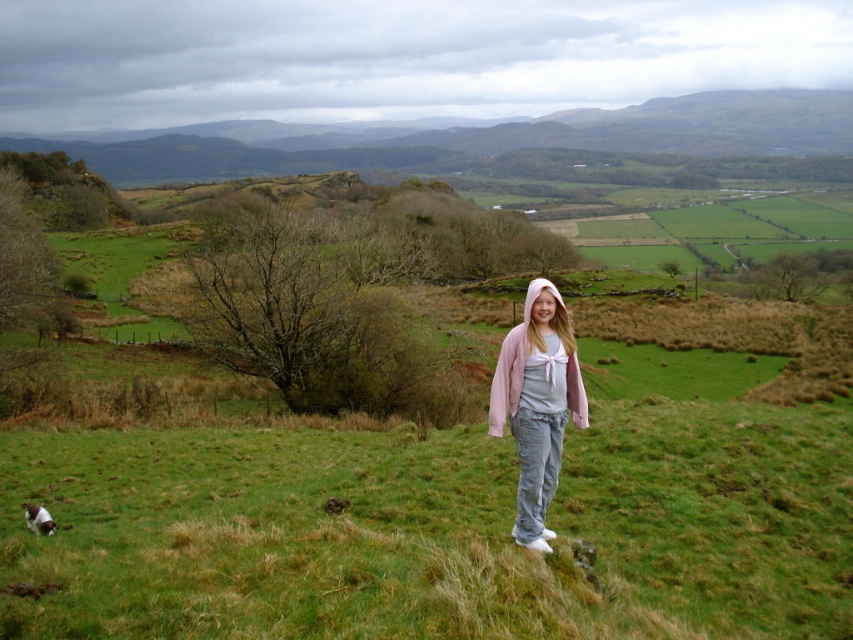
Between point (728, 148) and point (495, 381), which one is positioned behind?

The point (728, 148) is more distant.

The height and width of the screenshot is (640, 853). What are the coordinates of `green grassy hillside at upper center` in the screenshot? It's located at (495, 138).